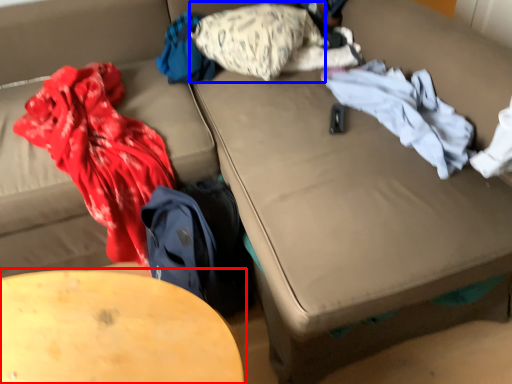
Question: Which object is closer to the camera taking this photo, table (highlighted by a red box) or pillow (highlighted by a blue box)?

Choices:
 (A) table
 (B) pillow

Answer: (A)